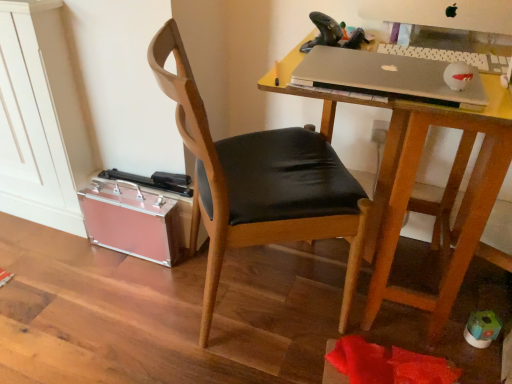
Question: Is silver metallic laptop at upper right aimed at wooden chair at center?

Choices:
 (A) no
 (B) yes

Answer: (B)

Question: Is silver metallic laptop at upper right at the left side of wooden chair at center?

Choices:
 (A) yes
 (B) no

Answer: (B)

Question: From the image's perspective, is silver metallic laptop at upper right beneath wooden chair at center?

Choices:
 (A) no
 (B) yes

Answer: (A)

Question: Is silver metallic laptop at upper right positioned behind wooden chair at center?

Choices:
 (A) no
 (B) yes

Answer: (B)

Question: Is silver metallic laptop at upper right bigger than wooden chair at center?

Choices:
 (A) yes
 (B) no

Answer: (B)

Question: Would you say wooden desk at center is inside or outside wooden chair at center?

Choices:
 (A) outside
 (B) inside

Answer: (A)

Question: From a real-world perspective, is wooden desk at center physically located above or below wooden chair at center?

Choices:
 (A) above
 (B) below

Answer: (B)

Question: Based on their sizes in the image, would you say wooden desk at center is bigger or smaller than wooden chair at center?

Choices:
 (A) big
 (B) small

Answer: (A)

Question: From the image's perspective, relative to wooden chair at center, is wooden desk at center above or below?

Choices:
 (A) above
 (B) below

Answer: (B)

Question: From the image's perspective, is silver metallic laptop at upper right positioned above or below wooden chair at center?

Choices:
 (A) below
 (B) above

Answer: (B)

Question: Is silver metallic laptop at upper right wider or thinner than wooden chair at center?

Choices:
 (A) wide
 (B) thin

Answer: (B)

Question: Choose the correct answer: Is silver metallic laptop at upper right inside wooden chair at center or outside it?

Choices:
 (A) outside
 (B) inside

Answer: (B)

Question: Is silver metallic laptop at upper right taller or shorter than wooden chair at center?

Choices:
 (A) tall
 (B) short

Answer: (B)

Question: Is wooden desk at center taller or shorter than silver metallic keyboard at upper right?

Choices:
 (A) tall
 (B) short

Answer: (A)

Question: Choose the correct answer: Is wooden desk at center inside silver metallic keyboard at upper right or outside it?

Choices:
 (A) inside
 (B) outside

Answer: (B)